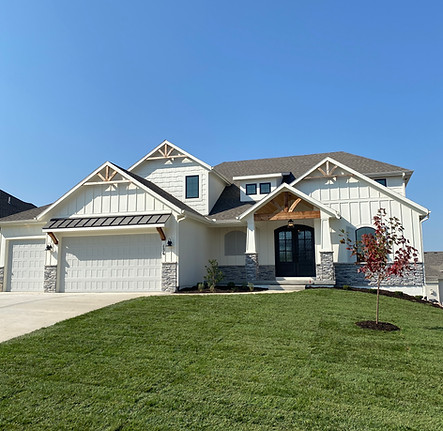
Find the location of `garage`. garage is located at coordinates (121, 262).